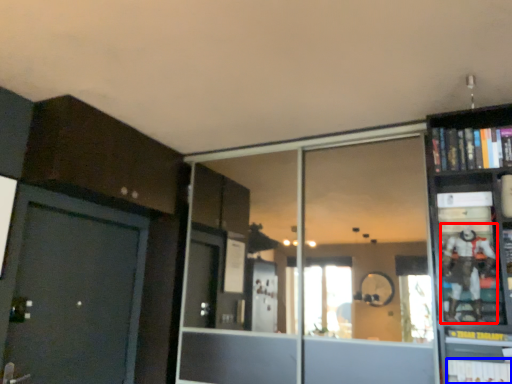
Question: Which point is further to the camera, toy (highlighted by a red box) or book (highlighted by a blue box)?

Choices:
 (A) toy
 (B) book

Answer: (A)